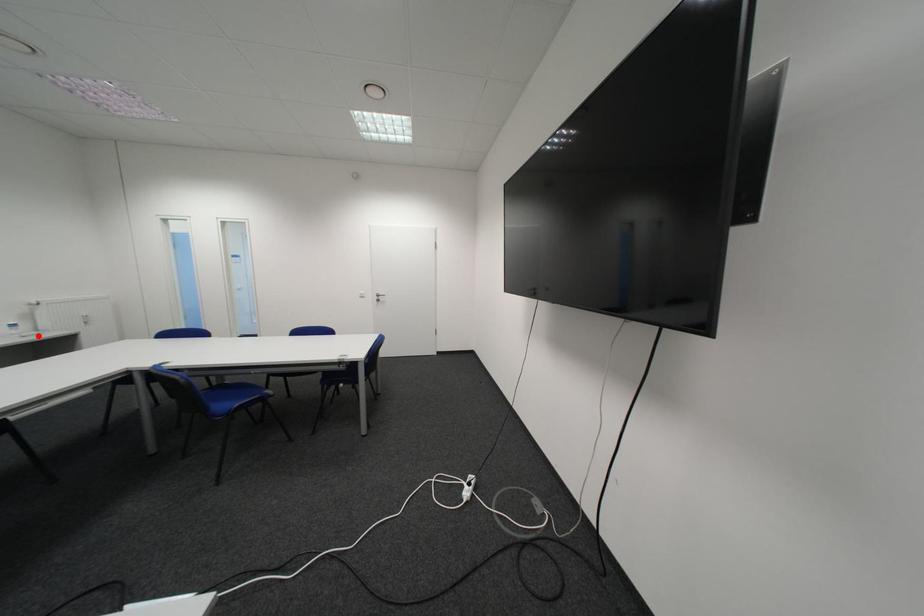
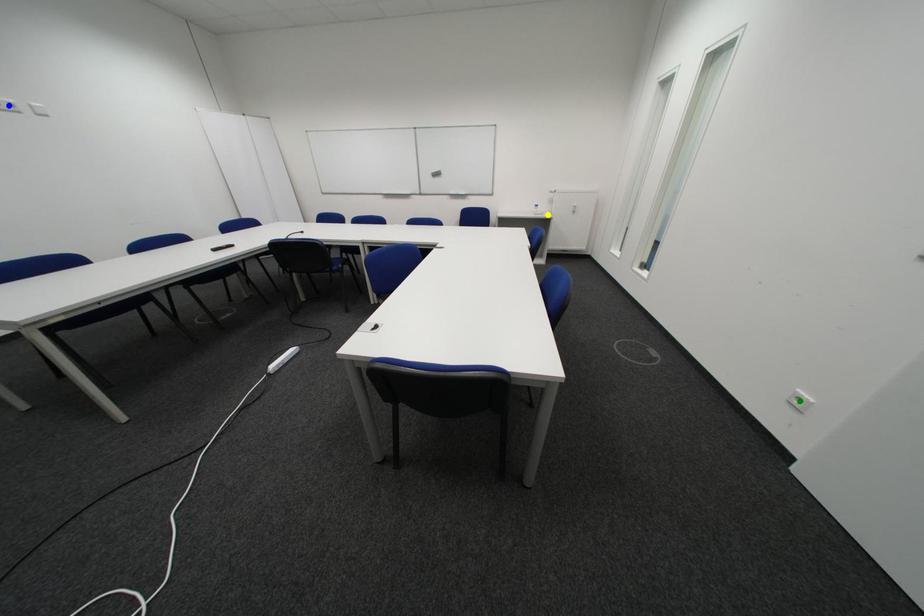
Question: I am providing you with two images of the same scene from different viewpoints. A red point is marked on the first image. You are given multiple points on the second image. Which spot in image 2 lines up with the point in image 1?

Choices:
 (A) yellow point
 (B) green point
 (C) blue point

Answer: (A)